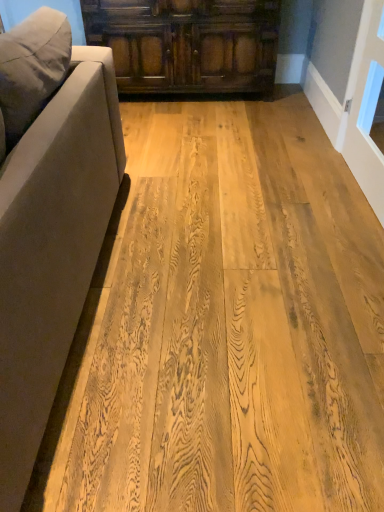
Image resolution: width=384 pixels, height=512 pixels. What do you see at coordinates (230, 324) in the screenshot? I see `natural wood floor at center` at bounding box center [230, 324].

Identify the location of suede-like beige couch at left. (48, 218).

Does suede-like beige couch at left have a lesser height compared to dark brown wood cabinet at upper center?

In fact, suede-like beige couch at left may be taller than dark brown wood cabinet at upper center.

Considering the sizes of objects suede-like beige couch at left and dark brown wood cabinet at upper center in the image provided, who is bigger, suede-like beige couch at left or dark brown wood cabinet at upper center?

suede-like beige couch at left is bigger.

From the image's perspective, which is below, suede-like beige couch at left or dark brown wood cabinet at upper center?

suede-like beige couch at left appears lower in the image.

Would you consider suede-like beige couch at left to be distant from dark brown wood cabinet at upper center?

suede-like beige couch at left is positioned a significant distance from dark brown wood cabinet at upper center.

Where is `plywood on the right of dark brown wood cabinet at upper center`? The width and height of the screenshot is (384, 512). plywood on the right of dark brown wood cabinet at upper center is located at coordinates (230, 324).

Which object is further away from the camera, natural wood floor at center or dark brown wood cabinet at upper center?

dark brown wood cabinet at upper center is more distant.

Is point (369, 272) closer or farther from the camera than point (146, 9)?

Point (369, 272).

Is dark brown wood cabinet at upper center at the back of natural wood floor at center?

natural wood floor at center is not turned away from dark brown wood cabinet at upper center.

Would you say suede-like beige couch at left is a long distance from natural wood floor at center?

That's not correct — suede-like beige couch at left is a little close to natural wood floor at center.

Is suede-like beige couch at left positioned before natural wood floor at center?

Yes, suede-like beige couch at left is in front of natural wood floor at center.

Which is in front, point (216, 44) or point (9, 177)?

The point (9, 177) is more forward.

Which object is wider, dark brown wood cabinet at upper center or suede-like beige couch at left?

Wider between the two is suede-like beige couch at left.

You are a GUI agent. You are given a task and a screenshot of the screen. Output one action in this format:
    pyautogui.click(x=<x>, y=<y>)
    Task: Click on the cabinetry that appears behind the suede-like beige couch at left
    This screenshot has height=512, width=384.
    Given the screenshot: What is the action you would take?
    pyautogui.click(x=187, y=44)

Is natural wood floor at center outside of suede-like beige couch at left?

That's correct, natural wood floor at center is outside of suede-like beige couch at left.

Is natural wood floor at center placed right next to suede-like beige couch at left?

natural wood floor at center is not next to suede-like beige couch at left, and they're not touching.

Consider the image. Looking at their sizes, would you say natural wood floor at center is wider or thinner than suede-like beige couch at left?

natural wood floor at center is thinner than suede-like beige couch at left.

How many degrees apart are the facing directions of dark brown wood cabinet at upper center and natural wood floor at center?

88 degrees.

Are dark brown wood cabinet at upper center and natural wood floor at center making contact?

They are not placed beside each other.

Can you confirm if dark brown wood cabinet at upper center is bigger than natural wood floor at center?

Indeed, dark brown wood cabinet at upper center has a larger size compared to natural wood floor at center.

Looking at this image, is dark brown wood cabinet at upper center taller than natural wood floor at center?

Correct, dark brown wood cabinet at upper center is much taller as natural wood floor at center.

Where is `studio couch above the dark brown wood cabinet at upper center (from a real-world perspective)`? studio couch above the dark brown wood cabinet at upper center (from a real-world perspective) is located at coordinates (48, 218).

I want to click on plywood beneath the dark brown wood cabinet at upper center (from a real-world perspective), so [x=230, y=324].

Based on their spatial positions, is natural wood floor at center or suede-like beige couch at left further from dark brown wood cabinet at upper center?

The object further to dark brown wood cabinet at upper center is suede-like beige couch at left.

Based on their spatial positions, is dark brown wood cabinet at upper center or natural wood floor at center closer to suede-like beige couch at left?

natural wood floor at center.

Which object lies nearer to the anchor point suede-like beige couch at left, natural wood floor at center or dark brown wood cabinet at upper center?

Based on the image, natural wood floor at center appears to be nearer to suede-like beige couch at left.

Looking at the image, which one is located closer to dark brown wood cabinet at upper center, suede-like beige couch at left or natural wood floor at center?

natural wood floor at center lies closer to dark brown wood cabinet at upper center than the other object.

When comparing their distances from natural wood floor at center, does dark brown wood cabinet at upper center or suede-like beige couch at left seem closer?

suede-like beige couch at left lies closer to natural wood floor at center than the other object.

From the picture: Looking at the image, which one is located further to natural wood floor at center, suede-like beige couch at left or dark brown wood cabinet at upper center?

Among the two, dark brown wood cabinet at upper center is located further to natural wood floor at center.

Find the location of a particular element. The width and height of the screenshot is (384, 512). plywood between suede-like beige couch at left and dark brown wood cabinet at upper center in the front-back direction is located at coordinates (230, 324).